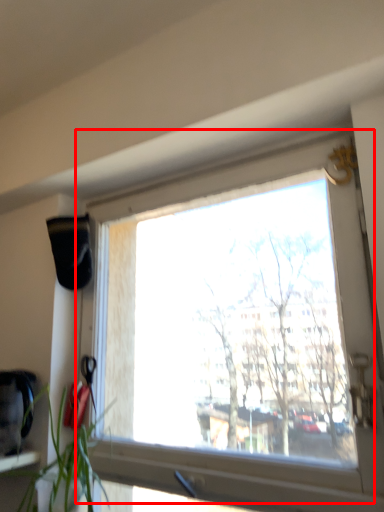
Question: Observing the image, what is the correct spatial positioning of window (annotated by the red box) in reference to houseplant?

Choices:
 (A) right
 (B) left

Answer: (A)